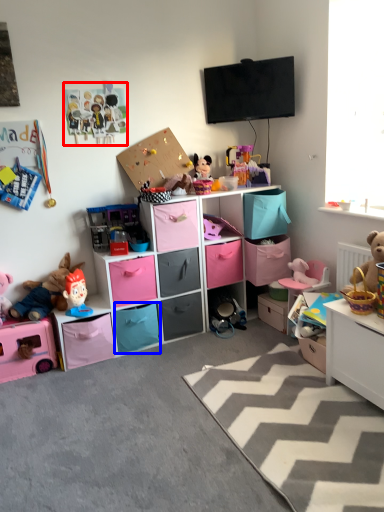
Question: Which point is further to the camera, toy (highlighted by a red box) or drawer (highlighted by a blue box)?

Choices:
 (A) toy
 (B) drawer

Answer: (B)